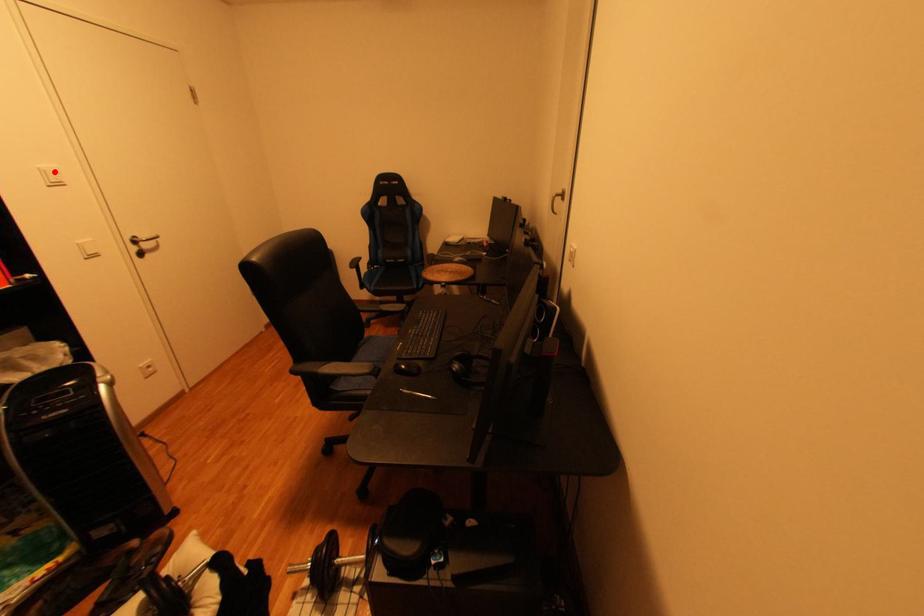
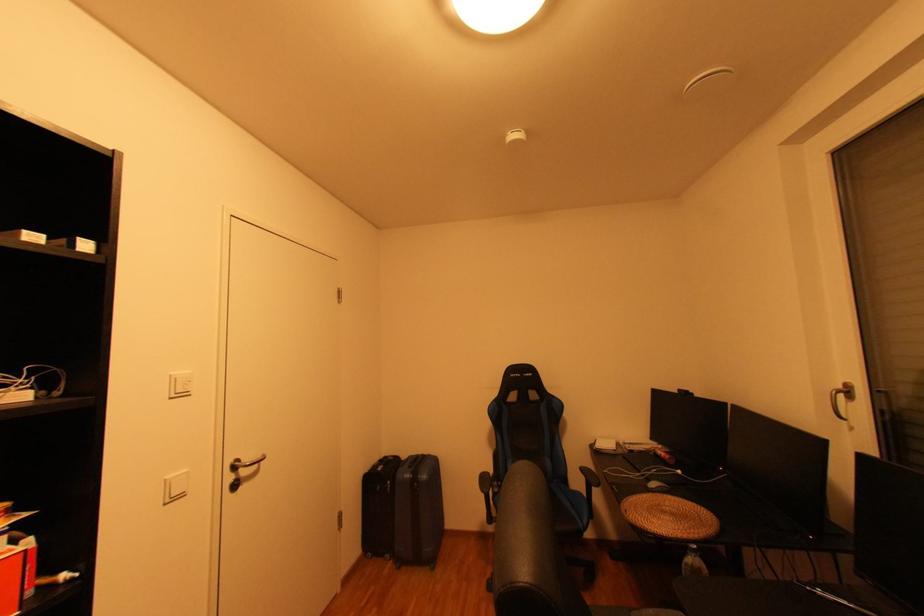
Where in the second image is the point corresponding to the highlighted location from the first image?

(185, 379)